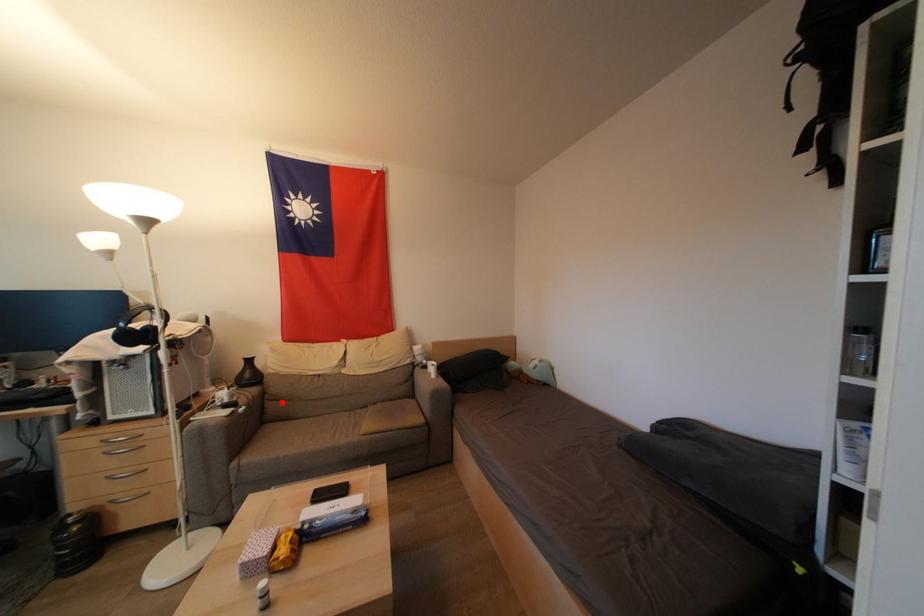
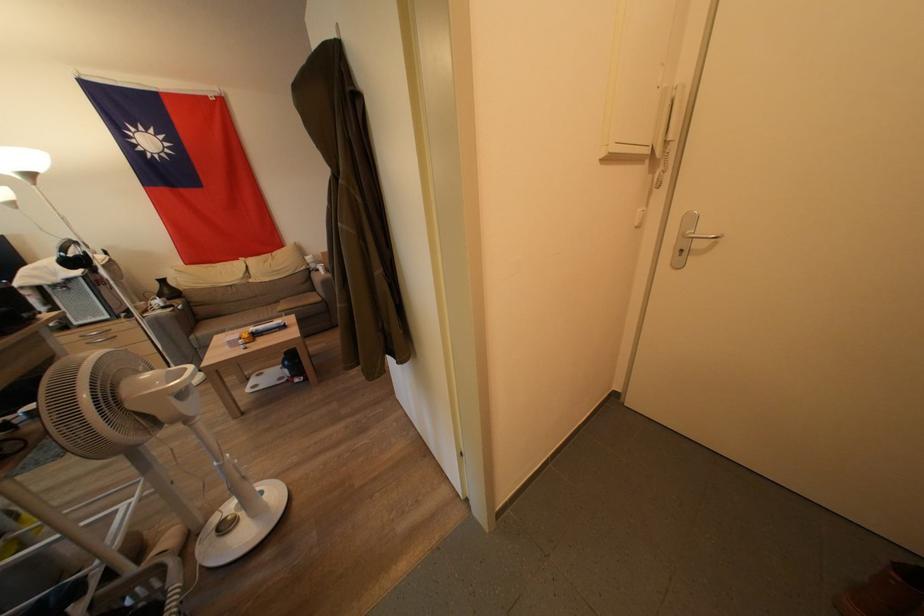
Question: I am providing you with two images of the same scene from different viewpoints. A red point is marked on the first image. Can you still see the location of the red point in image 2?

Choices:
 (A) Yes
 (B) No

Answer: (A)